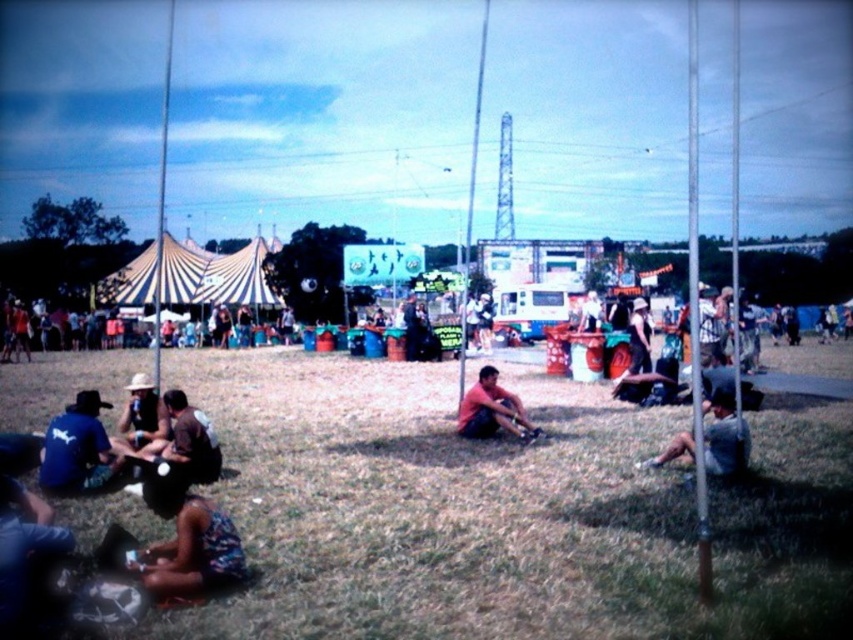
Question: Is green grass at lower center wider than blue fabric shirt at lower left?

Choices:
 (A) no
 (B) yes

Answer: (B)

Question: Does floral dress at lower left appear on the left side of dark gray fabric shirt at lower right?

Choices:
 (A) yes
 (B) no

Answer: (A)

Question: Which point appears farthest from the camera in this image?

Choices:
 (A) (514, 426)
 (B) (86, 400)
 (C) (744, 458)

Answer: (A)

Question: Among these objects, which one is farthest from the camera?

Choices:
 (A) matte red shirt at center
 (B) green grass at lower center
 (C) matte brown hat at lower left
 (D) dark gray fabric shirt at lower right

Answer: (A)

Question: Does green grass at lower center appear under dark gray fabric shirt at lower right?

Choices:
 (A) yes
 (B) no

Answer: (A)

Question: Estimate the real-world distances between objects in this image. Which object is farther from the blue fabric shirt at lower left?

Choices:
 (A) green grass at lower center
 (B) floral dress at lower left

Answer: (A)